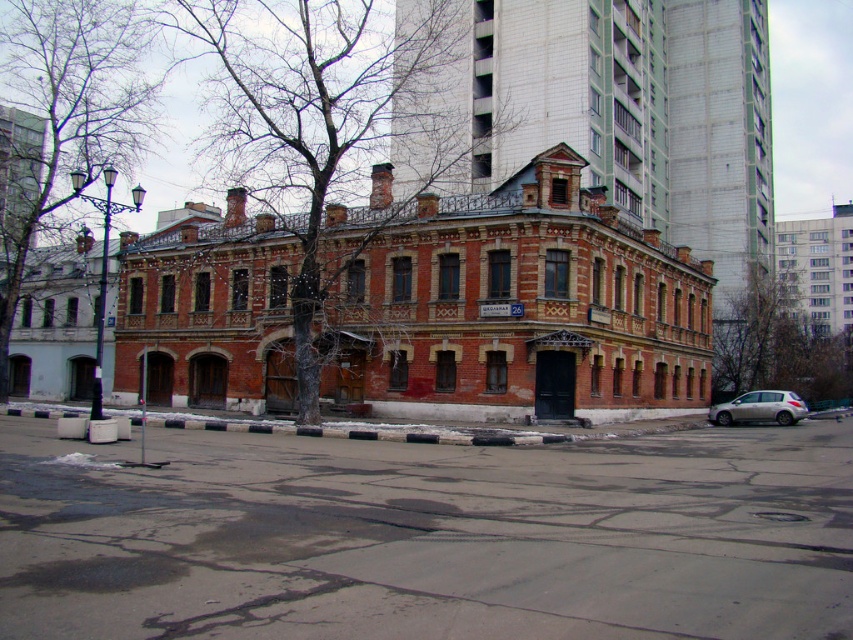
Question: Which of the following is the closest to the observer?

Choices:
 (A) (766, 406)
 (B) (262, 54)
 (C) (808, 364)

Answer: (A)

Question: Can you confirm if bare wood tree at center is positioned above silver metallic car at lower right?

Choices:
 (A) yes
 (B) no

Answer: (A)

Question: Among these points, which one is nearest to the camera?

Choices:
 (A) (311, 308)
 (B) (38, 1)
 (C) (741, 416)
 (D) (845, 333)

Answer: (A)

Question: Does bare branches at right have a smaller size compared to silver metallic car at lower right?

Choices:
 (A) yes
 (B) no

Answer: (B)

Question: Among these points, which one is farthest from the camera?

Choices:
 (A) (41, 228)
 (B) (778, 401)
 (C) (223, 29)

Answer: (C)

Question: Where is bare wood tree at center located in relation to bare branches at right in the image?

Choices:
 (A) above
 (B) below

Answer: (A)